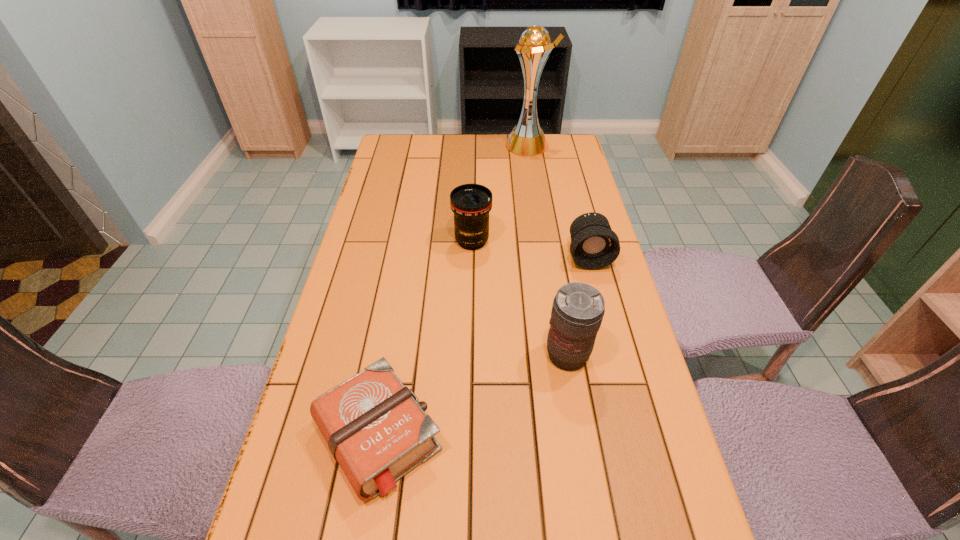
Where is `blank area at the far edge`? This screenshot has height=540, width=960. blank area at the far edge is located at coordinates (500, 150).

At what (x,y) coordinates should I click in order to perform the action: click on free point at the left edge. Please return your answer as a coordinate pair (x, y). The image size is (960, 540). Looking at the image, I should click on (400, 260).

This screenshot has width=960, height=540. What are the coordinates of `vacant space at the right edge of the desktop` in the screenshot? It's located at (574, 206).

Identify the location of free space at the far right corner. (552, 147).

Locate an element on the screen. This screenshot has width=960, height=540. vacant space in between the shortest object and the fourth tallest object is located at coordinates (484, 346).

You are a GUI agent. You are given a task and a screenshot of the screen. Output one action in this format:
    pyautogui.click(x=<x>, y=<y>)
    Task: Click on the empty space that is in between the nearest telephoto lens and the second tallest telephoto lens
    
    Given the screenshot: What is the action you would take?
    pyautogui.click(x=519, y=299)

Identify the location of vacant space that's between the shortest telephoto lens and the tallest object. The image size is (960, 540). (558, 200).

Identify the location of free space that is in between the tallest telephoto lens and the third tallest object. Image resolution: width=960 pixels, height=540 pixels. (519, 299).

In order to click on empty space that is in between the shortest telephoto lens and the Bible in this screenshot , I will do `click(484, 346)`.

I want to click on free space between the nearest telephoto lens and the tallest object, so click(547, 251).